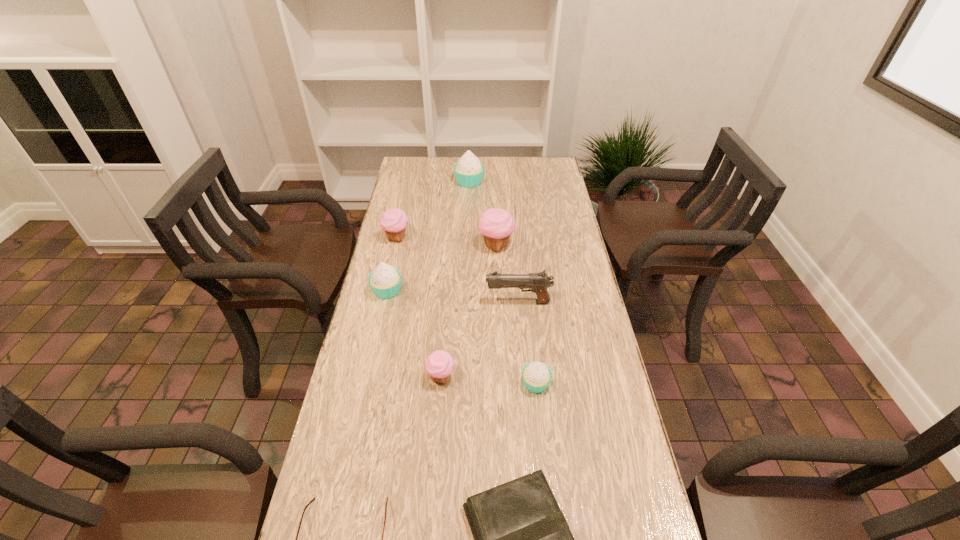
This screenshot has height=540, width=960. Find the location of `object at the far edge`. object at the far edge is located at coordinates (469, 171).

Where is `object present at the right edge`? The image size is (960, 540). object present at the right edge is located at coordinates (538, 282).

This screenshot has height=540, width=960. I want to click on vacant space at the far edge of the desktop, so click(516, 158).

Locate an element on the screen. free space at the left edge of the desktop is located at coordinates (414, 263).

Identify the location of vacant space at the right edge. (572, 292).

This screenshot has height=540, width=960. Find the location of `vacant area at the far left corner of the desktop`. vacant area at the far left corner of the desktop is located at coordinates (396, 183).

The image size is (960, 540). In the image, there is a desktop. Find the location of `vacant area at the far right corner`. vacant area at the far right corner is located at coordinates (537, 164).

Image resolution: width=960 pixels, height=540 pixels. Find the location of `unoccupied position between the leftmost pink cupcake and the second smallest white cupcake`. unoccupied position between the leftmost pink cupcake and the second smallest white cupcake is located at coordinates (392, 264).

Where is `empty location between the second farthest white cupcake and the leftmost pink cupcake`? Image resolution: width=960 pixels, height=540 pixels. empty location between the second farthest white cupcake and the leftmost pink cupcake is located at coordinates (392, 264).

Where is `vacant space in between the second smallest white cupcake and the biggest pink cupcake`? The image size is (960, 540). vacant space in between the second smallest white cupcake and the biggest pink cupcake is located at coordinates (442, 268).